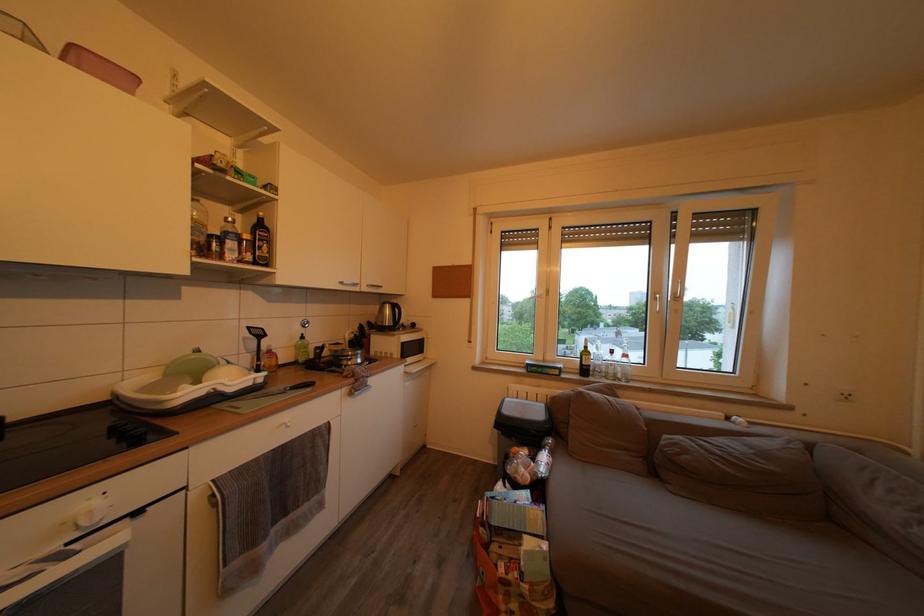
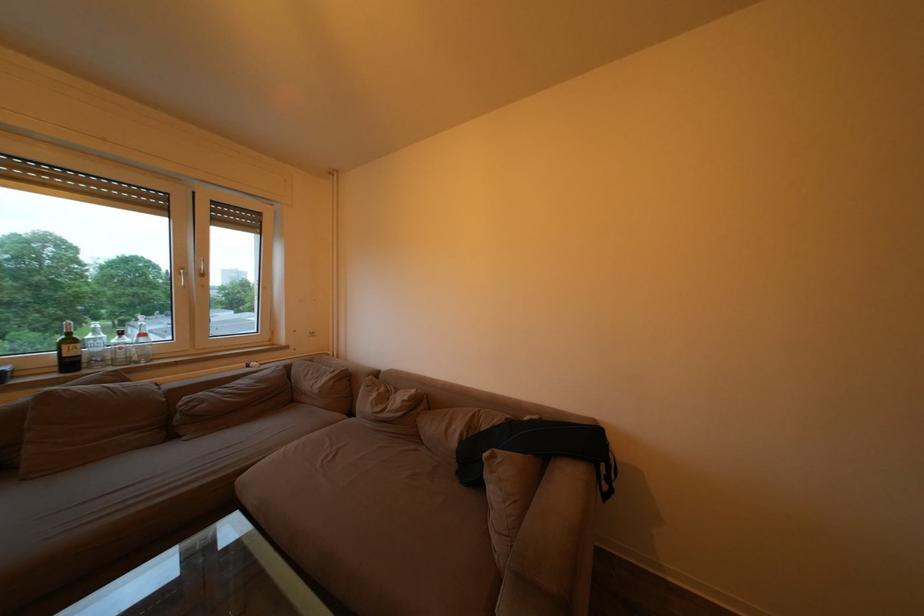
Find the pixel in the second image that matches point (593, 359) in the first image.

(79, 347)